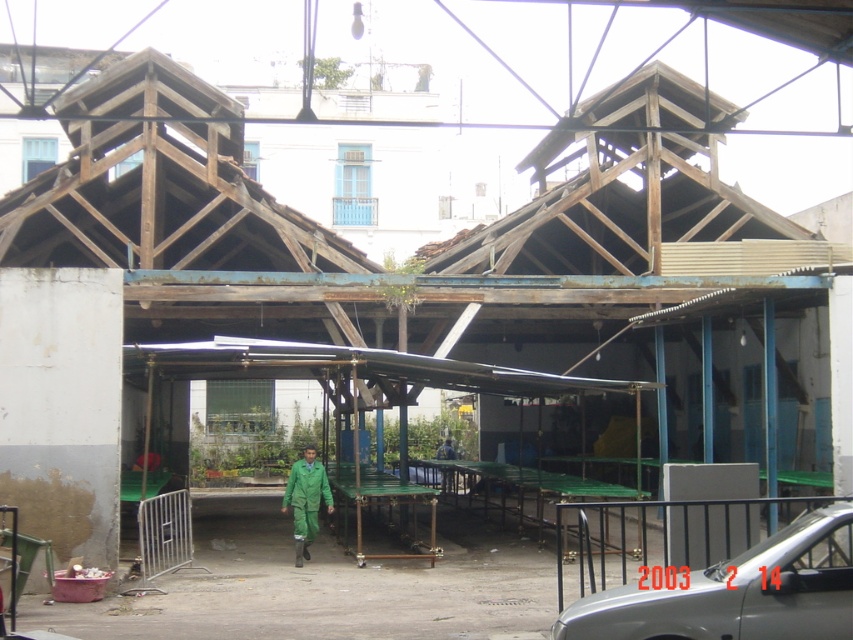
You are standing at the entrance of the construction site and see two points marked in the image. Which point, point (730, 518) or point (329, 499), is closer to you?

Point (730, 518) is closer to the viewer than point (329, 499).

You are standing at the entrance of the construction site and see the silver metallic car at lower right and the green matte jumpsuit at center. Which object is nearer to you?

The silver metallic car at lower right is closer to the viewer than the green matte jumpsuit at center, so the silver metallic car at lower right is nearer to you.

You are a delivery person who needs to park your silver metallic car at lower right near the construction site. However, there is a green matte jumpsuit at center in the way. Can your car pass through the space between the car and the jumpsuit without hitting them?

The silver metallic car at lower right is taller than the green matte jumpsuit at center, so the car can pass through the space between them without hitting, as the car is higher and the jumpsuit is lower.